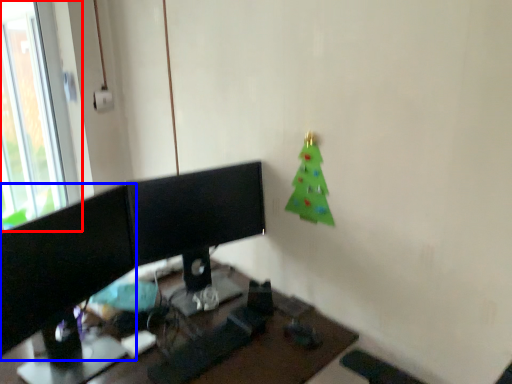
Question: Which object appears farthest to the camera in this image, window (highlighted by a red box) or computer monitor (highlighted by a blue box)?

Choices:
 (A) window
 (B) computer monitor

Answer: (A)